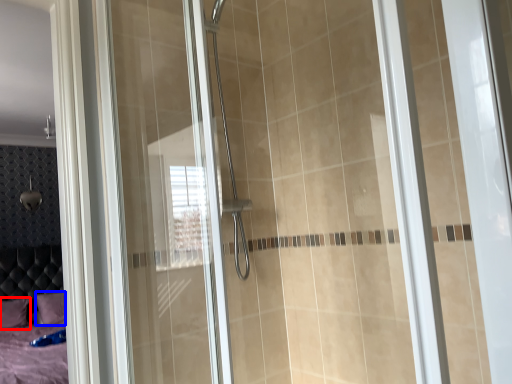
Question: Which point is further to the camera, pillow (highlighted by a red box) or pillow (highlighted by a blue box)?

Choices:
 (A) pillow
 (B) pillow

Answer: (A)